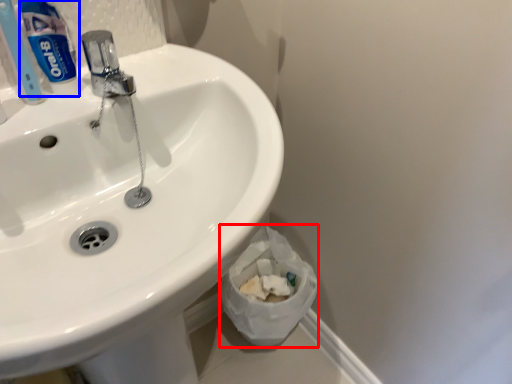
Question: Which of the following is the closest to the observer, toilet paper (highlighted by a red box) or toothpaste (highlighted by a blue box)?

Choices:
 (A) toilet paper
 (B) toothpaste

Answer: (B)